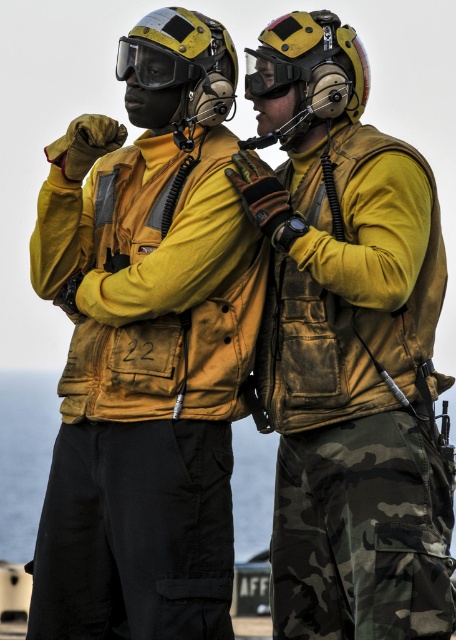
You are a technician responsible for ensuring equipment compatibility. The yellow matte helmet at upper center has a standard mounting system for accessories. Can the transparent plastic goggles at center be attached to it without any modifications?

The transparent plastic goggles at center can be attached to the yellow matte helmet at upper center since the distance between them is 20.87 inches, which is within the standard compatibility range for such equipment.

You are a military equipment inspector checking the gear of two pilots. You notice the yellow matte helmet at upper center and the transparent plastic goggles at center. Which of these two items is taller?

The yellow matte helmet at upper center is taller than the transparent plastic goggles at center.